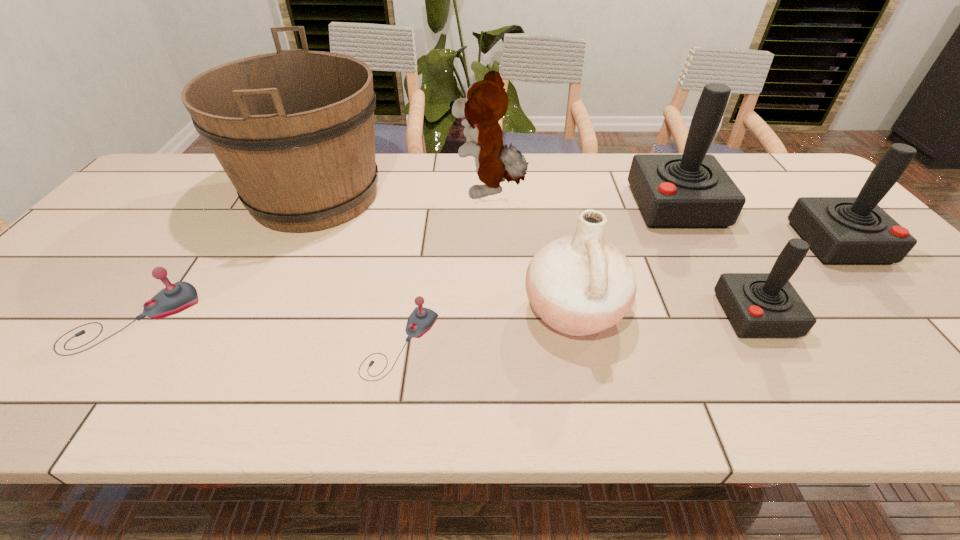
You are a GUI agent. You are given a task and a screenshot of the screen. Output one action in this format:
    pyautogui.click(x=<x>, y=<y>)
    Task: Click on the bucket
    
    Given the screenshot: What is the action you would take?
    pyautogui.click(x=294, y=131)

Where is `the tallest joystick`? The height and width of the screenshot is (540, 960). the tallest joystick is located at coordinates (691, 190).

You are a GUI agent. You are given a task and a screenshot of the screen. Output one action in this format:
    pyautogui.click(x=<x>, y=<y>)
    Task: Click on the puppy
    The height and width of the screenshot is (540, 960).
    Given the screenshot: What is the action you would take?
    pyautogui.click(x=486, y=102)

You are a GUI agent. You are given a task and a screenshot of the screen. Output one action in this format:
    pyautogui.click(x=<x>, y=<y>)
    Task: Click on the second tallest joystick
    The width and height of the screenshot is (960, 540).
    Given the screenshot: What is the action you would take?
    pyautogui.click(x=840, y=230)

This screenshot has height=540, width=960. I want to click on the rightmost red joystick, so click(840, 230).

Find the location of a particular element. The width and height of the screenshot is (960, 540). reddish-brown pottery is located at coordinates (580, 284).

In order to click on the third shortest object in this screenshot , I will do [x=757, y=304].

At what (x,y) coordinates should I click in order to perform the action: click on the third tallest joystick. Please return your answer as a coordinate pair (x, y). The height and width of the screenshot is (540, 960). Looking at the image, I should click on (757, 304).

Image resolution: width=960 pixels, height=540 pixels. Identify the location of the leftmost joystick. (175, 298).

I want to click on the second shortest joystick, so click(175, 298).